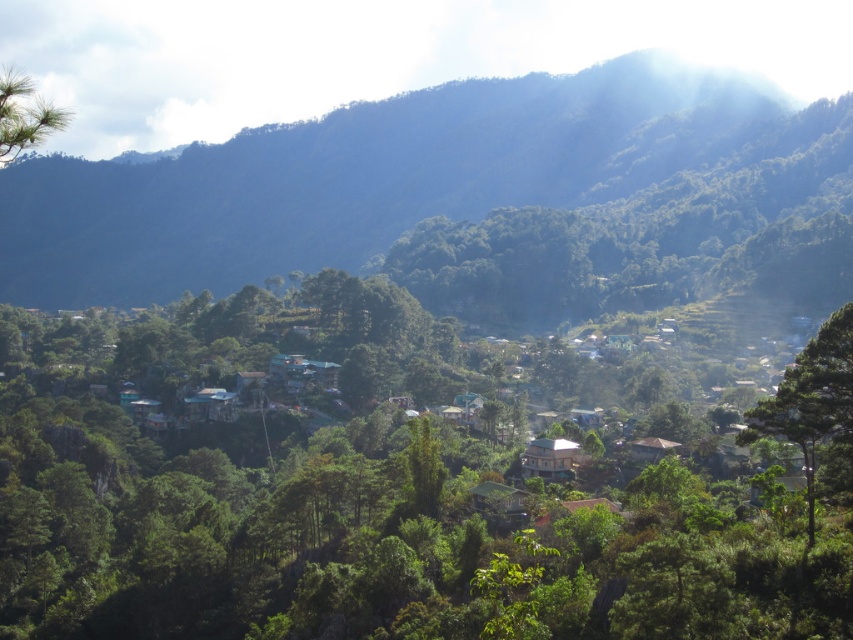
Is green leafy tree at center shorter than green matte tree at upper left?

No, green leafy tree at center is not shorter than green matte tree at upper left.

Can you confirm if green leafy tree at center is positioned to the right of green matte tree at upper left?

Correct, you'll find green leafy tree at center to the right of green matte tree at upper left.

Who is more distant from viewer, (567,492) or (38,120)?

Point (567,492)

Identify the location of green leafy tree at center. The width and height of the screenshot is (853, 640). (403, 481).

Can you confirm if green forested mountain at upper center is taller than green leafy tree at right?

Yes, green forested mountain at upper center is taller than green leafy tree at right.

Between green forested mountain at upper center and green leafy tree at right, which one is positioned higher?

green forested mountain at upper center is higher up.

What do you see at coordinates (386, 177) in the screenshot? The height and width of the screenshot is (640, 853). I see `green forested mountain at upper center` at bounding box center [386, 177].

Identify the location of green forested mountain at upper center. This screenshot has height=640, width=853. (386, 177).

Is green leafy tree at center below green forested mountain at upper center?

Yes, green leafy tree at center is below green forested mountain at upper center.

Is green leafy tree at center smaller than green forested mountain at upper center?

Indeed, green leafy tree at center has a smaller size compared to green forested mountain at upper center.

In the scene shown: Who is more forward, (x=158, y=317) or (x=579, y=145)?

Point (x=158, y=317)

Locate an element on the screen. The width and height of the screenshot is (853, 640). green leafy tree at center is located at coordinates [x=403, y=481].